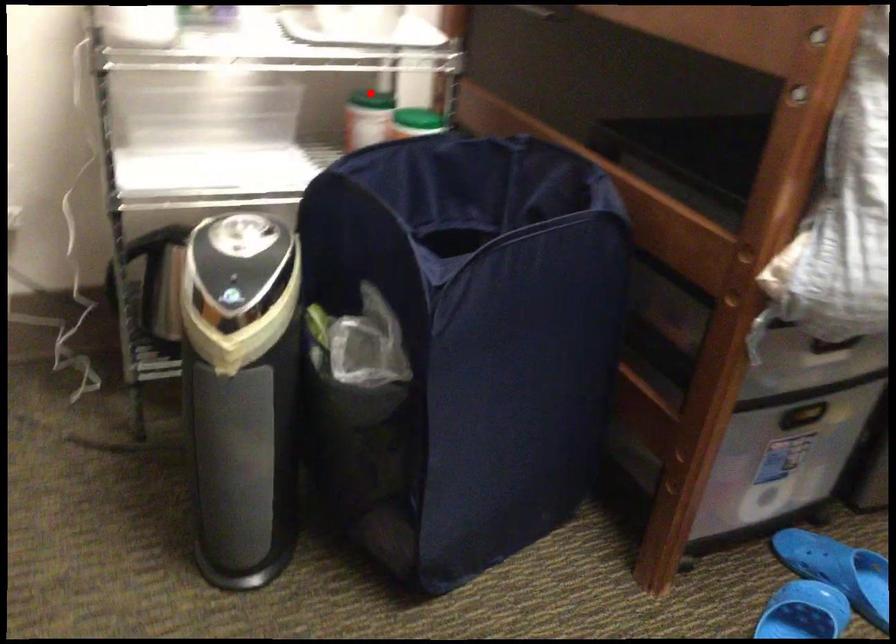
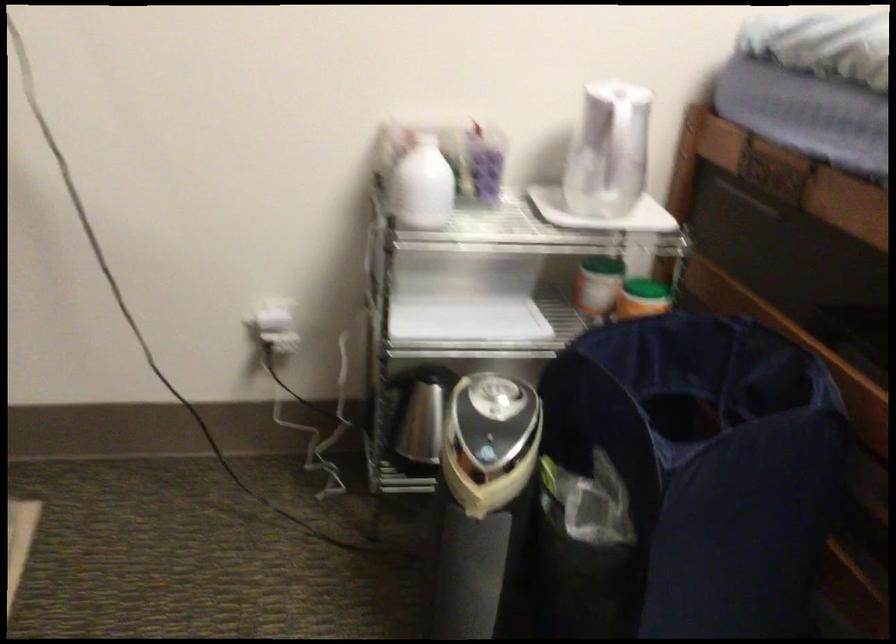
In the second image, find the point that corresponds to the highlighted location in the first image.

(602, 263)